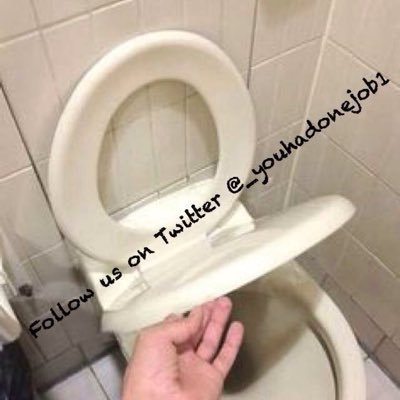
I want to click on toilet basin, so click(279, 366).